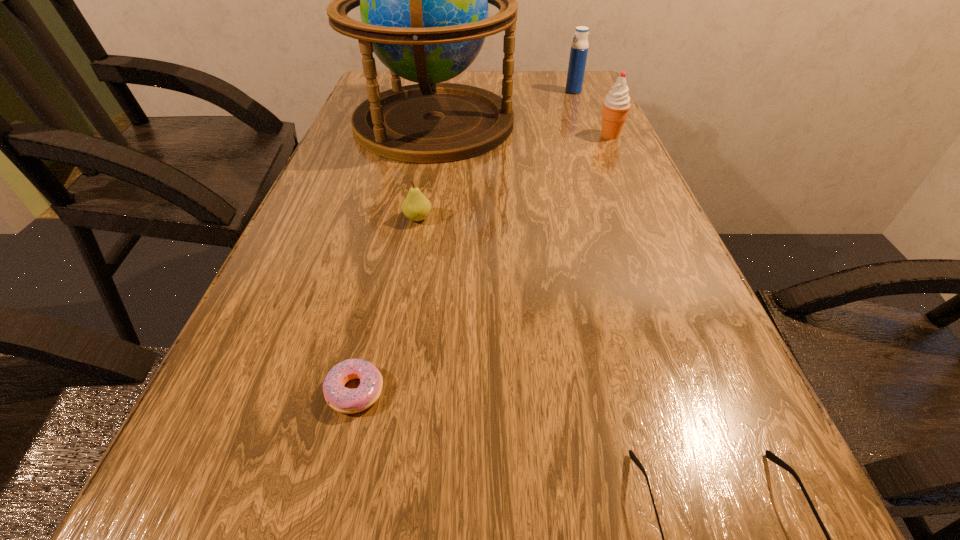
This screenshot has width=960, height=540. I want to click on vacant space situated 0.060m on the front of the pear, so click(413, 246).

The height and width of the screenshot is (540, 960). What are the coordinates of `vacant area located 0.090m on the left of the doughnut` in the screenshot? It's located at (263, 390).

Locate an element on the screen. The image size is (960, 540). globe present at the far edge is located at coordinates (423, 0).

Where is `water bottle that is at the far edge`? water bottle that is at the far edge is located at coordinates (579, 48).

Identify the location of object present at the left edge. (423, 0).

Image resolution: width=960 pixels, height=540 pixels. I want to click on water bottle present at the right edge, so click(579, 48).

This screenshot has height=540, width=960. I want to click on icecream located at the right edge, so [616, 105].

In order to click on object that is at the far left corner in this screenshot , I will do `click(423, 0)`.

Find the location of a particular element. Image resolution: width=960 pixels, height=540 pixels. object located at the far right corner is located at coordinates (579, 48).

I want to click on vacant space at the far edge, so 542,75.